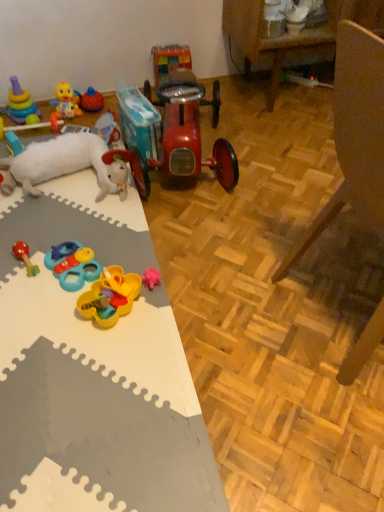
Identify the location of vacant area that is in front of rubberized red and green rattle at lower left, which ranks as the eighth toy in right-to-left order. The width and height of the screenshot is (384, 512). (28, 302).